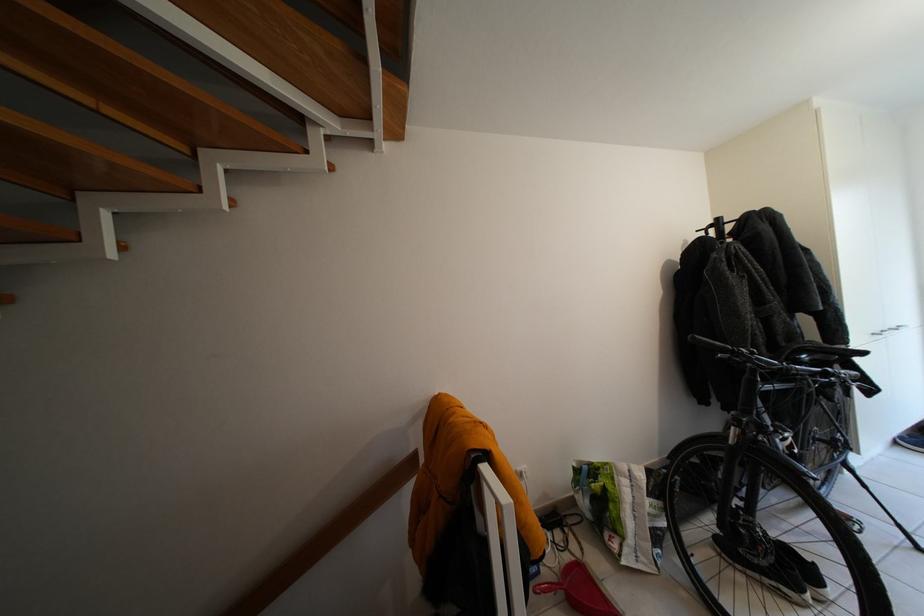
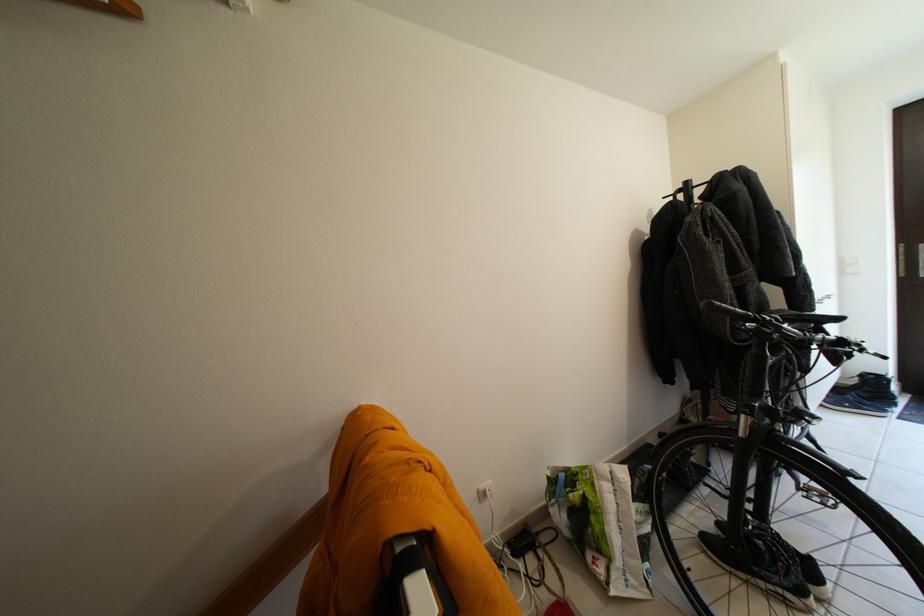
Locate, in the second image, the point that corresponds to point (772, 569) in the first image.

(794, 588)